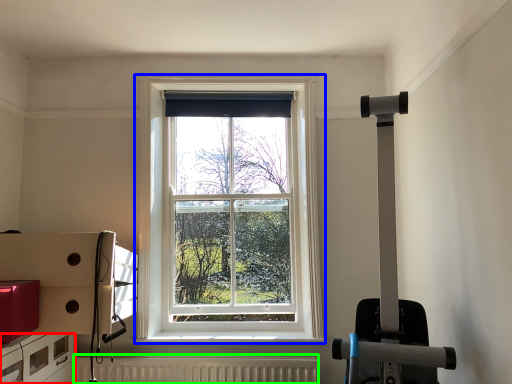
Question: Which object is the closest to the drawer (highlighted by a red box)? Choose among these: window (highlighted by a blue box) or radiator (highlighted by a green box).

Choices:
 (A) window
 (B) radiator

Answer: (B)